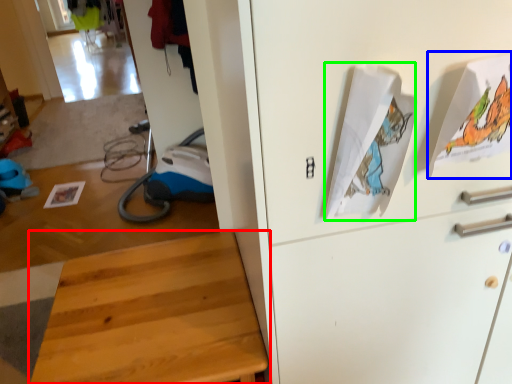
Question: Which is nearer to the furniture (highlighted by a red box)? wrapping paper (highlighted by a blue box) or wrapping paper (highlighted by a green box).

Choices:
 (A) wrapping paper
 (B) wrapping paper

Answer: (B)